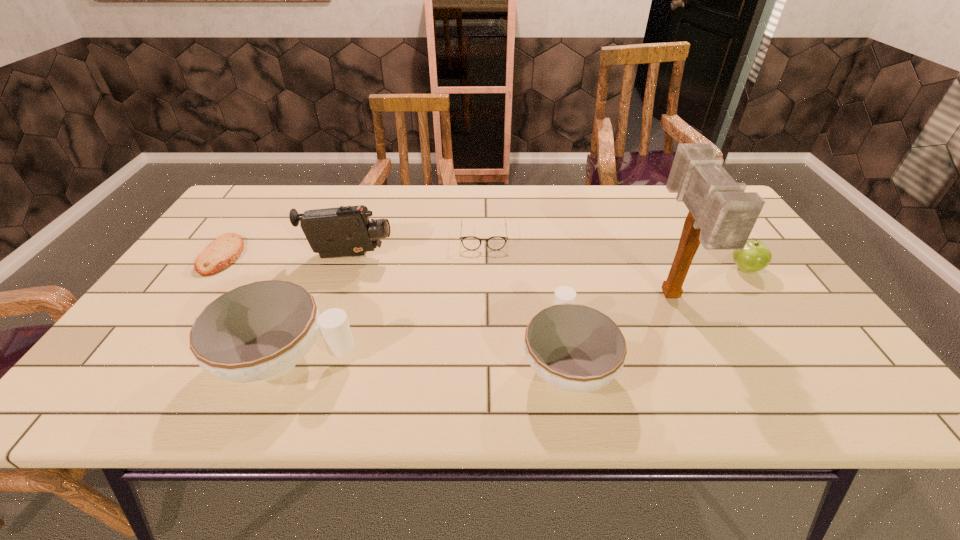
Please show where to add a chinaware on the right while keeping spacing even. Please provide its 2D coordinates. Your answer should be formatted as a tuple, i.e. [(x, y)], where the tuple contains the x and y coordinates of a point satisfying the conditions above.

[(849, 364)]